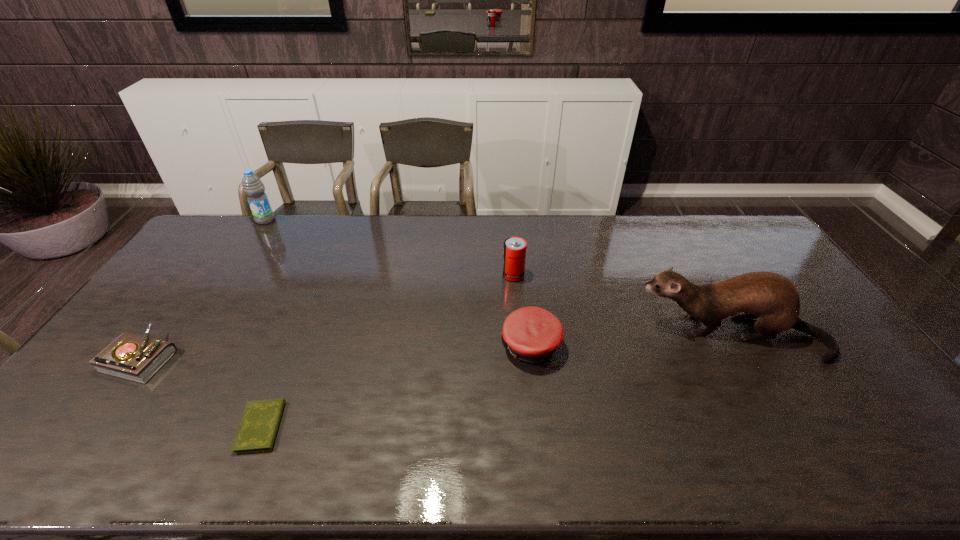
Image resolution: width=960 pixels, height=540 pixels. Find the location of `blank area in the image that satisfies the following two spatial constraints: 1. on the back side of the farther diary; 2. on the right side of the second farthest object`. blank area in the image that satisfies the following two spatial constraints: 1. on the back side of the farther diary; 2. on the right side of the second farthest object is located at coordinates coord(202,275).

You are a GUI agent. You are given a task and a screenshot of the screen. Output one action in this format:
    pyautogui.click(x=<x>, y=<y>)
    Task: Click on the vacant space that satisfies the following two spatial constraints: 1. on the back side of the farther diary; 2. on the left side of the water bottle
    Image resolution: width=960 pixels, height=540 pixels.
    Given the screenshot: What is the action you would take?
    pyautogui.click(x=242, y=220)